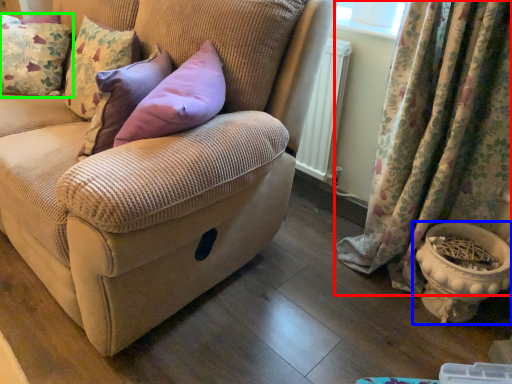
Question: Which object is positioned farthest from curtain (highlighted by a red box)? Select from flowerpot (highlighted by a blue box) and pillow (highlighted by a green box).

Choices:
 (A) flowerpot
 (B) pillow

Answer: (B)